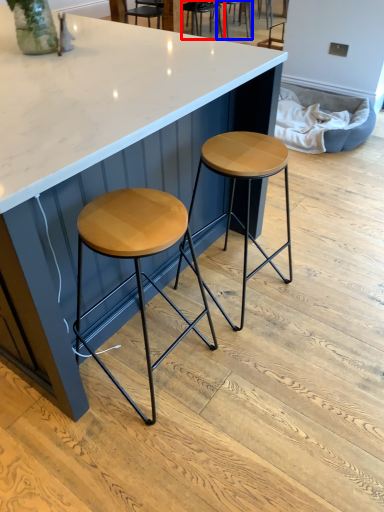
Question: Among these objects, which one is nearest to the camera, chair (highlighted by a red box) or chair (highlighted by a blue box)?

Choices:
 (A) chair
 (B) chair

Answer: (A)